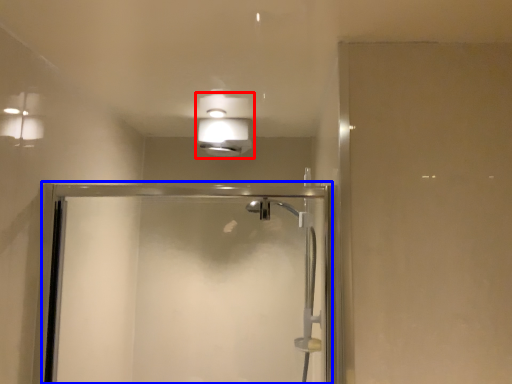
Question: Which of the following is the farthest to the observer, light fixture (highlighted by a red box) or screen door (highlighted by a blue box)?

Choices:
 (A) light fixture
 (B) screen door

Answer: (A)